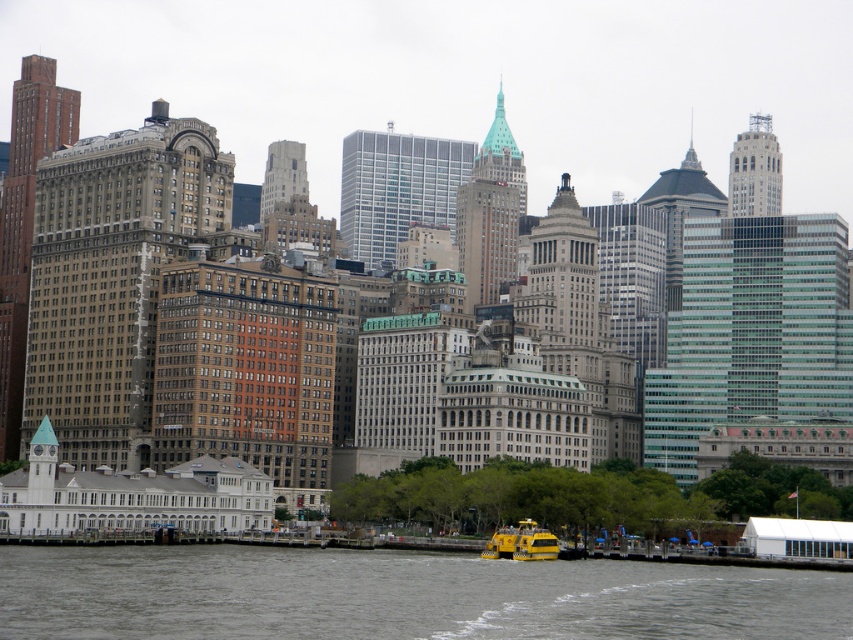
You are a photographer standing on the dock and want to capture both the gray water at lower center and the yellow rubber boat at lower center in a single shot. Which object should you focus on first to ensure both are in frame?

You should focus on the gray water at lower center first because it is taller than the yellow rubber boat at lower center, so adjusting the camera angle to include its height will naturally include the boat as well.

You are a tour guide leading a group on a sightseeing boat trip. Your boat, the yellow rubber boat at lower center, is approaching a dock. There is a gray water at lower center that you need to avoid. Can you safely navigate between them given the distance?

The gray water at lower center is 18.74 meters away from the yellow rubber boat at lower center. Since the distance is sufficient for safe navigation, the boat can safely pass between them without any issues.

You are a photographer standing at the edge of the waterfront, aiming to capture a shot that includes both the yellow ferry boat and the historic buildings in the midground. You notice two points marked in your viewfinder at coordinates point (764, 616) and point (485, 557). Which point should you focus on to ensure both the ferry boat and the buildings are in sharp focus?

You should focus on point (764, 616) because it is closer to the camera than point (485, 557). This will help ensure the ferry boat and buildings are in focus since focusing on the closer point creates a deeper depth of field, keeping both foreground and background elements sharp.